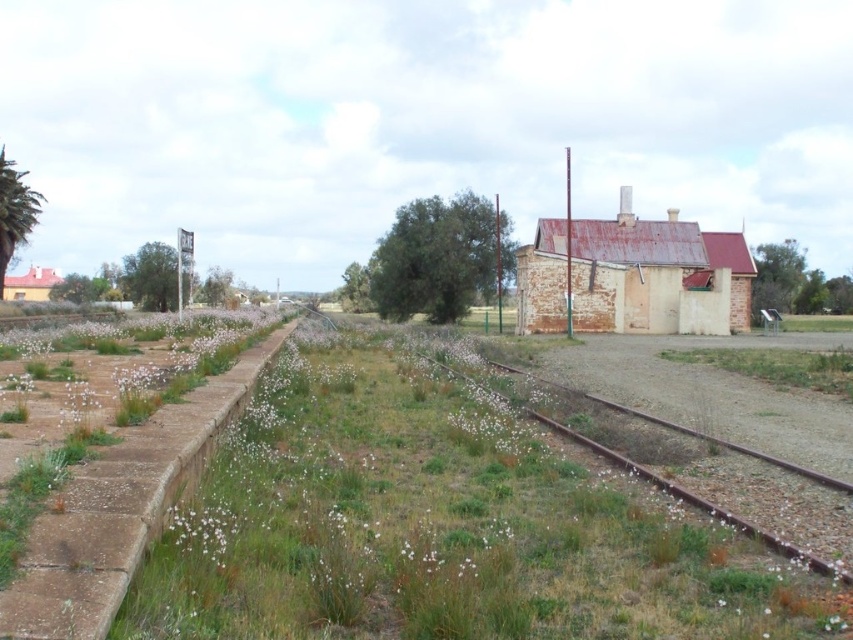
Between green grass at center and rusty metal train track at center, which one appears on the right side from the viewer's perspective?

From the viewer's perspective, rusty metal train track at center appears more on the right side.

Who is taller, green grass at center or rusty metal train track at center?

green grass at center

Between point (305, 582) and point (706, 435), which one is positioned behind?

The point (706, 435) is more distant.

You are a GUI agent. You are given a task and a screenshot of the screen. Output one action in this format:
    pyautogui.click(x=<x>, y=<y>)
    Task: Click on the green grass at center
    The image size is (853, 640).
    Given the screenshot: What is the action you would take?
    pyautogui.click(x=444, y=520)